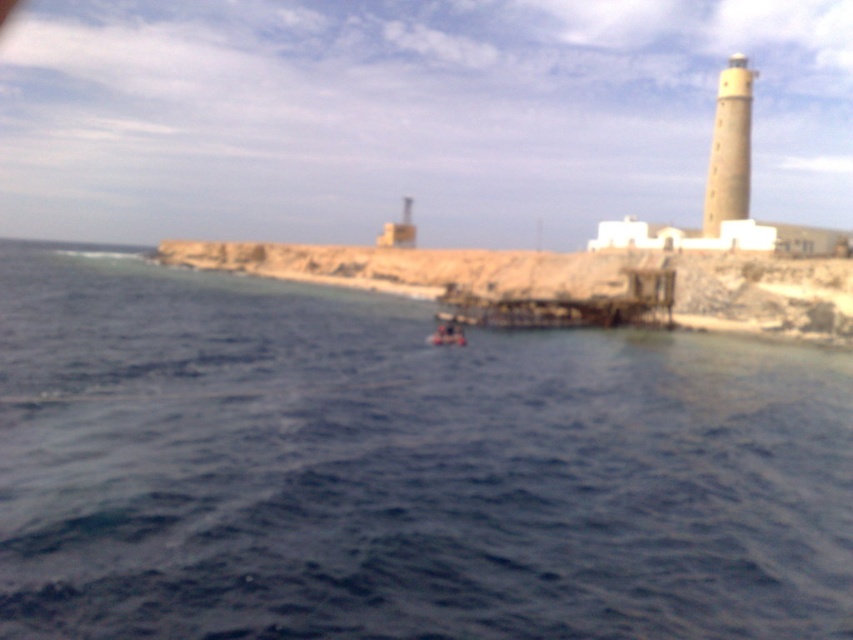
You are a seagull flying over the coastal area. You see the blue water at center and the brown rocky shoreline at center. Which one is closer to you?

The blue water at center is closer to you because it is in front of the brown rocky shoreline at center.

Based on the photo, you are a seagull flying over the coastal scene. You see the point marked at coordinates (x=564, y=280). What is located at that point?

The point at coordinates (x=564, y=280) is where the brown rocky shoreline at center is located.